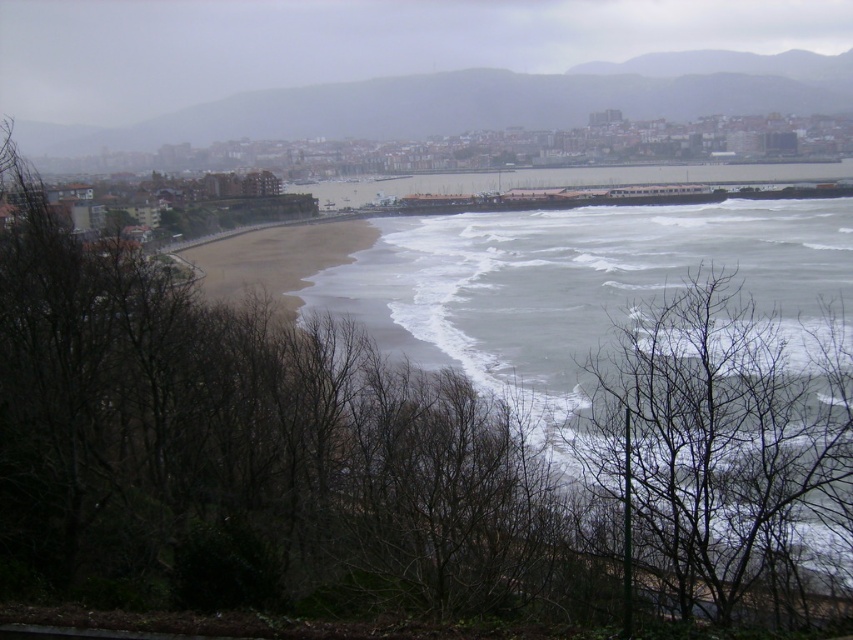
You are standing on the beach in the coastal scene and want to walk towards the buildings. You notice two points marked on the image. Which point, point [764,396] or point [636,449], is closer to you as you face the scene?

Point [764,396] is further to the viewer than point [636,449]. Therefore, point [636,449] is closer to you as you face the scene.